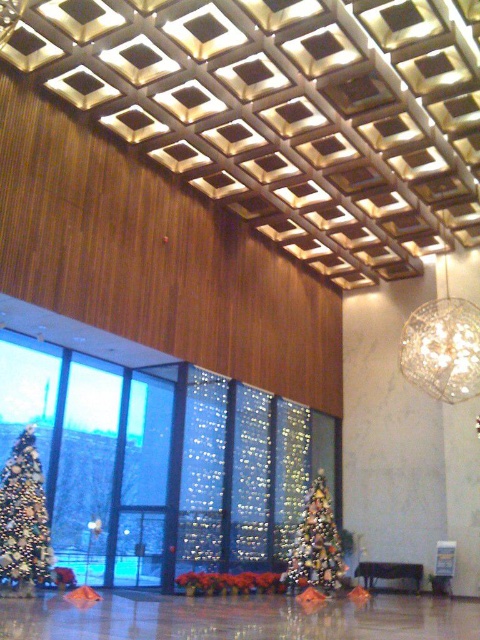
You are a visitor standing in the lobby and want to take a photo of both shiny gold christmas tree at left and shiny gold christmas tree at center. Which tree should you position closer to in order to capture both in the frame?

To capture both the shiny gold christmas tree at left and the shiny gold christmas tree at center in the frame, you should position closer to the shiny gold christmas tree at left since it is smaller and requires less space in the photo to be visible.

You are a visitor in the lobby and want to take a photo of the shiny gold christmas tree at left and the shiny gold christmas tree at center. Which one will appear larger in your photo?

The shiny gold christmas tree at left will appear larger in your photo because it is closer to you than the shiny gold christmas tree at center.

From the picture: You are standing in the lobby and want to place a new potted plant in the corner diagonally opposite to the shiny gold christmas tree at left. Which corner should you go to?

The shiny gold christmas tree at left is located at point (24,518). The diagonally opposite corner would be the bottom right corner of the lobby.